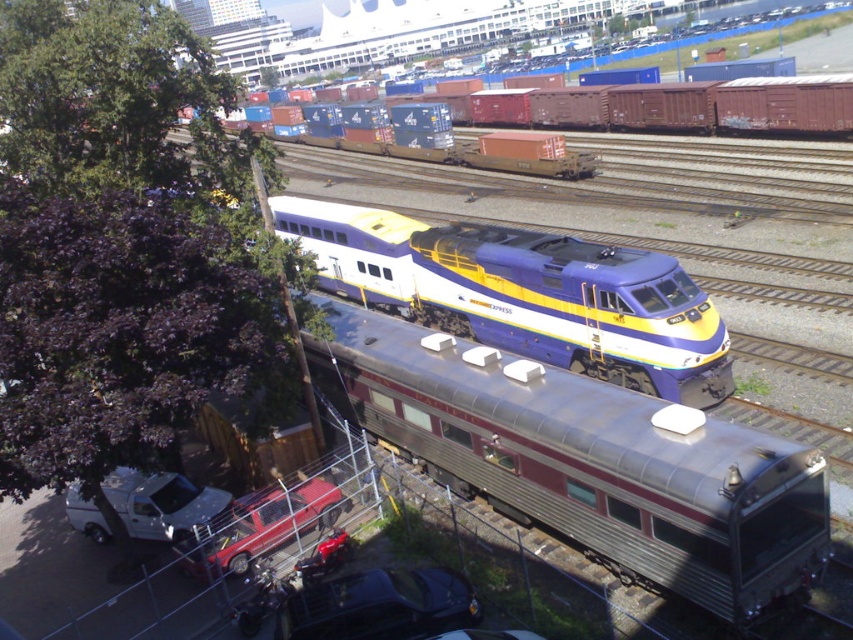
Question: Does green leafy tree at upper left come behind white matte truck at lower left?

Choices:
 (A) no
 (B) yes

Answer: (B)

Question: Does metallic blue and yellow passenger train at center appear on the left side of white matte truck at lower left?

Choices:
 (A) no
 (B) yes

Answer: (A)

Question: Which of the following is the farthest from the observer?

Choices:
 (A) shiny black car at lower center
 (B) green leafy tree at upper left

Answer: (B)

Question: Which object is the farthest from the metallic freight car at upper center?

Choices:
 (A) shiny black car at lower center
 (B) metallic blue and yellow passenger train at center

Answer: (A)

Question: Is metallic freight car at upper center to the left of white matte truck at lower left from the viewer's perspective?

Choices:
 (A) yes
 (B) no

Answer: (B)

Question: Which point is closer to the camera taking this photo?

Choices:
 (A) (73, 512)
 (B) (492, 280)
 (C) (613, 113)

Answer: (A)